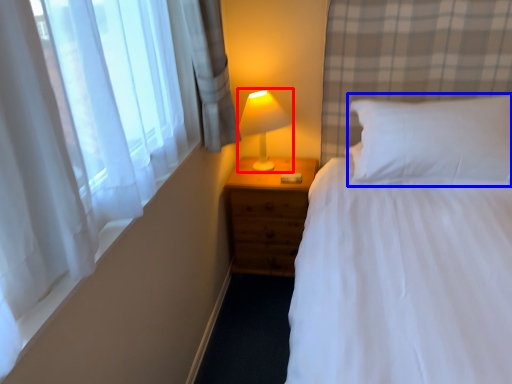
Question: Which point is closer to the camera, lamp (highlighted by a red box) or pillow (highlighted by a blue box)?

Choices:
 (A) lamp
 (B) pillow

Answer: (B)